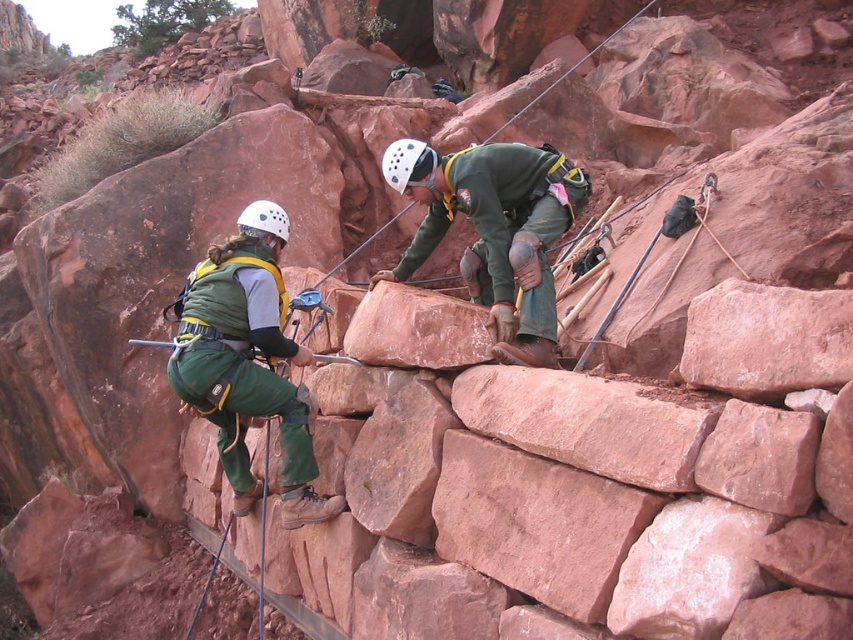
Question: Can you confirm if green fabric harness at center is positioned to the right of green fabric safety vest at center?

Choices:
 (A) no
 (B) yes

Answer: (B)

Question: Which of the following is the farthest from the observer?

Choices:
 (A) (418, 164)
 (B) (238, 260)
 (C) (267, 209)

Answer: (C)

Question: Which point appears closest to the camera in this image?

Choices:
 (A) (524, 205)
 (B) (288, 236)
 (C) (219, 262)
 (D) (242, 326)

Answer: (D)

Question: Which object is positioned closest to the green fabric climbing harness at center?

Choices:
 (A) white matte helmet at upper center
 (B) white matte helmet at center
 (C) green fabric safety vest at center

Answer: (A)

Question: Can you confirm if green fabric harness at center is positioned to the left of green fabric safety vest at center?

Choices:
 (A) yes
 (B) no

Answer: (B)

Question: Observing the image, what is the correct spatial positioning of green fabric harness at center in reference to green fabric climbing harness at center?

Choices:
 (A) above
 (B) below

Answer: (B)